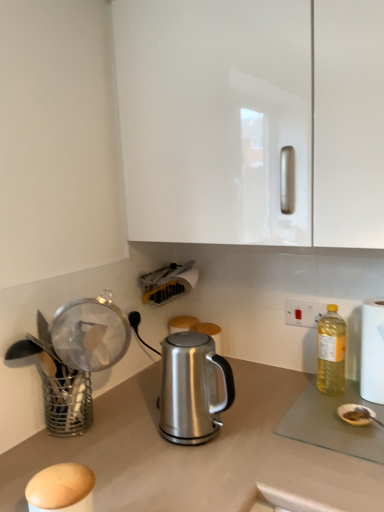
What is the approximate height of metallic wire basket at left?

The height of metallic wire basket at left is 6.65 inches.

Where is `satin silver kettle at center`? Image resolution: width=384 pixels, height=512 pixels. satin silver kettle at center is located at coordinates (192, 388).

Locate an element on the screen. The height and width of the screenshot is (512, 384). white glossy cabinet at upper center is located at coordinates (252, 121).

Is satin silver kettle at center facing away from white paper towel at right?

satin silver kettle at center is not turned away from white paper towel at right.

How far apart are satin silver kettle at center and white paper towel at right?

They are 18.65 inches apart.

Would you say satin silver kettle at center is a long distance from white paper towel at right?

No, satin silver kettle at center is not far from white paper towel at right.

Considering the sizes of satin silver kettle at center and white paper towel at right in the image, is satin silver kettle at center wider or thinner than white paper towel at right?

satin silver kettle at center is wider than white paper towel at right.

Is metallic wire basket at left inside the boundaries of yellow translucent bottle at right, or outside?

metallic wire basket at left is not enclosed by yellow translucent bottle at right.

Between metallic wire basket at left and yellow translucent bottle at right, which one has larger size?

metallic wire basket at left.

Considering the sizes of metallic wire basket at left and yellow translucent bottle at right in the image, is metallic wire basket at left taller or shorter than yellow translucent bottle at right?

Considering their sizes, metallic wire basket at left has less height than yellow translucent bottle at right.

From a real-world perspective, which object rests below the other?

metallic wire basket at left.

Which is behind, point (137, 86) or point (340, 342)?

Positioned behind is point (340, 342).

Is white glossy cabinet at upper center with yellow translucent bottle at right?

white glossy cabinet at upper center and yellow translucent bottle at right are clearly separated.

In the image, there is a yellow translucent bottle at right. At what (x,y) coordinates should I click in order to perform the action: click on cabinetry above it (from the image's perspective). Please return your answer as a coordinate pair (x, y). Looking at the image, I should click on (252, 121).

Is white glossy cabinet at upper center to the right of yellow translucent bottle at right from the viewer's perspective?

In fact, white glossy cabinet at upper center is to the left of yellow translucent bottle at right.

Is white plastic electric outlet at upper right wider than white paper towel at right?

In fact, white plastic electric outlet at upper right might be narrower than white paper towel at right.

From a real-world perspective, between white plastic electric outlet at upper right and white paper towel at right, who is vertically lower?

In real-world perspective, white paper towel at right is lower.

Is white plastic electric outlet at upper right aimed at white paper towel at right?

No, white plastic electric outlet at upper right is not turned towards white paper towel at right.

Is white plastic electric outlet at upper right in contact with white paper towel at right?

No, white plastic electric outlet at upper right is not with white paper towel at right.

Looking at their sizes, would you say white glossy cabinet at upper center is wider or thinner than satin silver kettle at center?

Clearly, white glossy cabinet at upper center has more width compared to satin silver kettle at center.

Can you confirm if white glossy cabinet at upper center is bigger than satin silver kettle at center?

Yes.

Is the surface of white glossy cabinet at upper center in direct contact with satin silver kettle at center?

No, white glossy cabinet at upper center is not next to satin silver kettle at center.

Which object is positioned more to the right, white glossy cabinet at upper center or satin silver kettle at center?

From the viewer's perspective, white glossy cabinet at upper center appears more on the right side.

Measure the distance from white paper towel at right to white plastic electric outlet at upper right.

white paper towel at right is 21.50 centimeters away from white plastic electric outlet at upper right.

Can you confirm if white paper towel at right is thinner than white plastic electric outlet at upper right?

Incorrect, the width of white paper towel at right is not less than that of white plastic electric outlet at upper right.

Is white paper towel at right not close to white plastic electric outlet at upper right?

No, there isn't a large distance between white paper towel at right and white plastic electric outlet at upper right.

Is point (363, 305) positioned behind point (319, 310)?

No, (363, 305) is in front of (319, 310).

In terms of width, does metallic wire basket at left look wider or thinner when compared to white glossy cabinet at upper center?

In the image, metallic wire basket at left appears to be more narrow than white glossy cabinet at upper center.

From the image's perspective, is metallic wire basket at left on top of white glossy cabinet at upper center?

No, from the image's perspective, metallic wire basket at left is not above white glossy cabinet at upper center.

From a real-world perspective, who is located lower, metallic wire basket at left or white glossy cabinet at upper center?

From a 3D spatial view, metallic wire basket at left is below.

Is metallic wire basket at left facing towards white glossy cabinet at upper center?

No, metallic wire basket at left is not turned towards white glossy cabinet at upper center.

Locate an element on the screen. This screenshot has height=512, width=384. kettle that is under the white paper towel at right (from a real-world perspective) is located at coordinates (192, 388).

Locate an element on the screen. This screenshot has width=384, height=512. bottle behind the metallic wire basket at left is located at coordinates (331, 352).

Looking at the image, which one is located closer to white plastic electric outlet at upper right, white paper towel at right or metallic wire basket at left?

The object closer to white plastic electric outlet at upper right is white paper towel at right.

Looking at this image, estimate the real-world distances between objects in this image. Which object is closer to satin silver kettle at center, white plastic electric outlet at upper right or white paper towel at right?

The object closer to satin silver kettle at center is white paper towel at right.

Looking at the image, which one is located closer to white glossy cabinet at upper center, white paper towel at right or yellow translucent bottle at right?

white paper towel at right.

Estimate the real-world distances between objects in this image. Which object is closer to metallic wire basket at left, satin silver kettle at center or white glossy cabinet at upper center?

Based on the image, satin silver kettle at center appears to be nearer to metallic wire basket at left.

Estimate the real-world distances between objects in this image. Which object is closer to yellow translucent bottle at right, white plastic electric outlet at upper right or metallic wire basket at left?

white plastic electric outlet at upper right lies closer to yellow translucent bottle at right than the other object.

Based on their spatial positions, is white paper towel at right or yellow translucent bottle at right closer to white plastic electric outlet at upper right?

The object closer to white plastic electric outlet at upper right is yellow translucent bottle at right.

When comparing their distances from white plastic electric outlet at upper right, does white paper towel at right or white glossy cabinet at upper center seem further?

white glossy cabinet at upper center is positioned further to the anchor white plastic electric outlet at upper right.

Consider the image. Which object lies nearer to the anchor point white paper towel at right, satin silver kettle at center or yellow translucent bottle at right?

yellow translucent bottle at right is positioned closer to the anchor white paper towel at right.

The image size is (384, 512). Find the location of `electric outlet between satin silver kettle at center and yellow translucent bottle at right in the horizontal direction`. electric outlet between satin silver kettle at center and yellow translucent bottle at right in the horizontal direction is located at coordinates (303, 313).

The width and height of the screenshot is (384, 512). Identify the location of electric outlet between white glossy cabinet at upper center and yellow translucent bottle at right in the vertical direction. (303, 313).

Identify the location of bottle positioned between white paper towel at right and white plastic electric outlet at upper right from near to far. (331, 352).

This screenshot has width=384, height=512. I want to click on bottle between white glossy cabinet at upper center and white paper towel at right vertically, so click(331, 352).